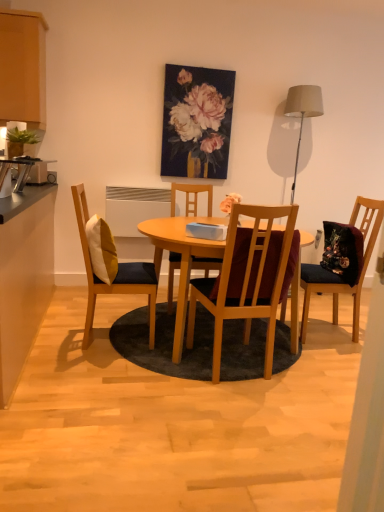
Question: Is yellow and white cushioned chair at left, the 4th chair from the right, further to the viewer compared to oil paint canvas at upper center?

Choices:
 (A) yes
 (B) no

Answer: (B)

Question: Does yellow and white cushioned chair at left, the 4th chair from the right, lie in front of oil paint canvas at upper center?

Choices:
 (A) yes
 (B) no

Answer: (A)

Question: From the image's perspective, is yellow and white cushioned chair at left, which appears as the 1th chair when viewed from the left, located beneath oil paint canvas at upper center?

Choices:
 (A) no
 (B) yes

Answer: (B)

Question: Considering the relative sizes of yellow and white cushioned chair at left, which appears as the 1th chair when viewed from the left, and oil paint canvas at upper center in the image provided, is yellow and white cushioned chair at left, which appears as the 1th chair when viewed from the left, wider than oil paint canvas at upper center?

Choices:
 (A) no
 (B) yes

Answer: (B)

Question: Is yellow and white cushioned chair at left, the 4th chair from the right, beside oil paint canvas at upper center?

Choices:
 (A) no
 (B) yes

Answer: (A)

Question: Can you confirm if yellow and white cushioned chair at left, which appears as the 1th chair when viewed from the left, is taller than oil paint canvas at upper center?

Choices:
 (A) no
 (B) yes

Answer: (B)

Question: Could matte beige lampshade at upper right be considered to be inside white plastic radiator at center?

Choices:
 (A) yes
 (B) no

Answer: (B)

Question: From a real-world perspective, does white plastic radiator at center sit lower than matte beige lampshade at upper right?

Choices:
 (A) yes
 (B) no

Answer: (A)

Question: Could you tell me if white plastic radiator at center is facing matte beige lampshade at upper right?

Choices:
 (A) yes
 (B) no

Answer: (B)

Question: Does white plastic radiator at center have a smaller size compared to matte beige lampshade at upper right?

Choices:
 (A) yes
 (B) no

Answer: (A)

Question: Would you consider white plastic radiator at center to be distant from matte beige lampshade at upper right?

Choices:
 (A) yes
 (B) no

Answer: (A)

Question: Considering the relative sizes of white plastic radiator at center and matte beige lampshade at upper right in the image provided, is white plastic radiator at center thinner than matte beige lampshade at upper right?

Choices:
 (A) yes
 (B) no

Answer: (A)

Question: Are matte beige lampshade at upper right and black laminate countertop at left, which is the 1th cabinetry from bottom to top, making contact?

Choices:
 (A) yes
 (B) no

Answer: (B)